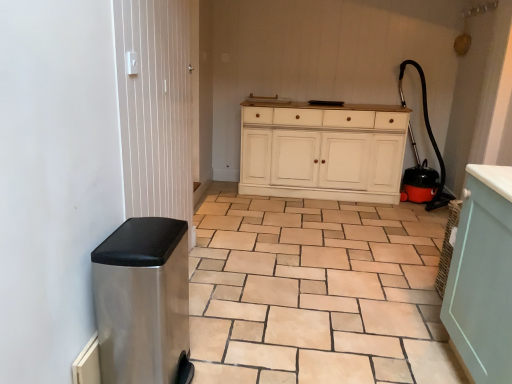
Question: Considering the relative positions of slate gray ceramic tile at lower left and metallic silver screen door at left in the image provided, is slate gray ceramic tile at lower left to the right of metallic silver screen door at left from the viewer's perspective?

Choices:
 (A) yes
 (B) no

Answer: (A)

Question: Is slate gray ceramic tile at lower left in front of metallic silver screen door at left?

Choices:
 (A) yes
 (B) no

Answer: (B)

Question: Does slate gray ceramic tile at lower left come behind metallic silver screen door at left?

Choices:
 (A) no
 (B) yes

Answer: (B)

Question: Is slate gray ceramic tile at lower left facing towards metallic silver screen door at left?

Choices:
 (A) no
 (B) yes

Answer: (A)

Question: From a real-world perspective, does slate gray ceramic tile at lower left stand above metallic silver screen door at left?

Choices:
 (A) yes
 (B) no

Answer: (B)

Question: Is slate gray ceramic tile at lower left oriented away from metallic silver screen door at left?

Choices:
 (A) yes
 (B) no

Answer: (B)

Question: Is metallic silver screen door at left thinner than stainless steel trash can at left?

Choices:
 (A) yes
 (B) no

Answer: (A)

Question: Considering the relative positions of metallic silver screen door at left and stainless steel trash can at left in the image provided, is metallic silver screen door at left to the right of stainless steel trash can at left from the viewer's perspective?

Choices:
 (A) no
 (B) yes

Answer: (A)

Question: Can you confirm if metallic silver screen door at left is bigger than stainless steel trash can at left?

Choices:
 (A) no
 (B) yes

Answer: (A)

Question: From a real-world perspective, is metallic silver screen door at left below stainless steel trash can at left?

Choices:
 (A) no
 (B) yes

Answer: (A)

Question: Is metallic silver screen door at left oriented towards stainless steel trash can at left?

Choices:
 (A) yes
 (B) no

Answer: (B)

Question: Is the depth of metallic silver screen door at left less than that of stainless steel trash can at left?

Choices:
 (A) yes
 (B) no

Answer: (B)

Question: Can you confirm if stainless steel trash can at left is smaller than metallic silver screen door at left?

Choices:
 (A) no
 (B) yes

Answer: (A)